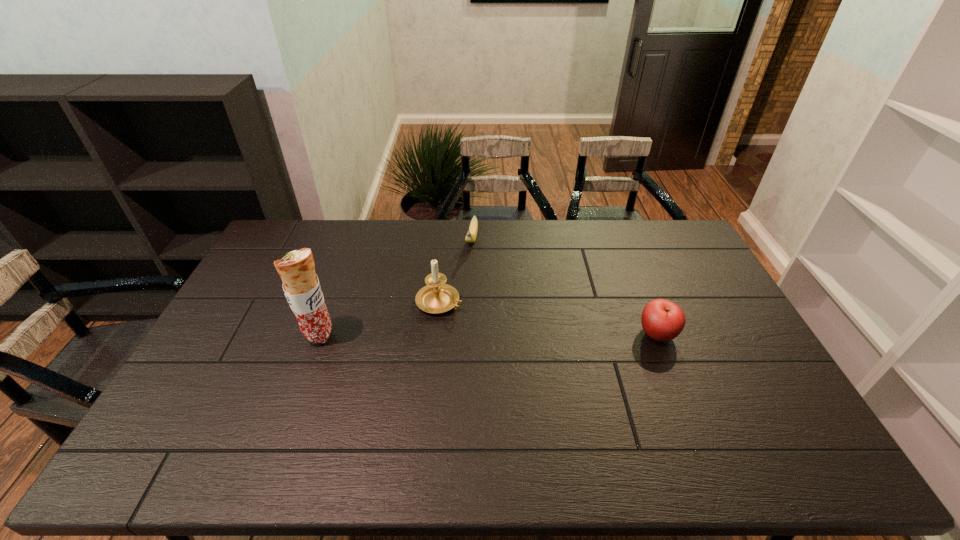
Image resolution: width=960 pixels, height=540 pixels. I want to click on free space on the desktop that is between the leftmost object and the apple and is positioned at the stem of the farthest object, so click(450, 335).

The width and height of the screenshot is (960, 540). Identify the location of free space on the desktop that is between the tallest object and the rightmost object and is positioned with a handle on the side of the second object from left to right. tap(516, 335).